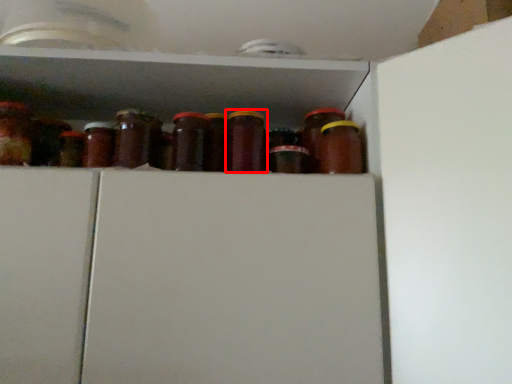
Question: Considering the relative positions of bottle (annotated by the red box) and bottle in the image provided, where is bottle (annotated by the red box) located with respect to the staircase?

Choices:
 (A) right
 (B) left

Answer: (B)